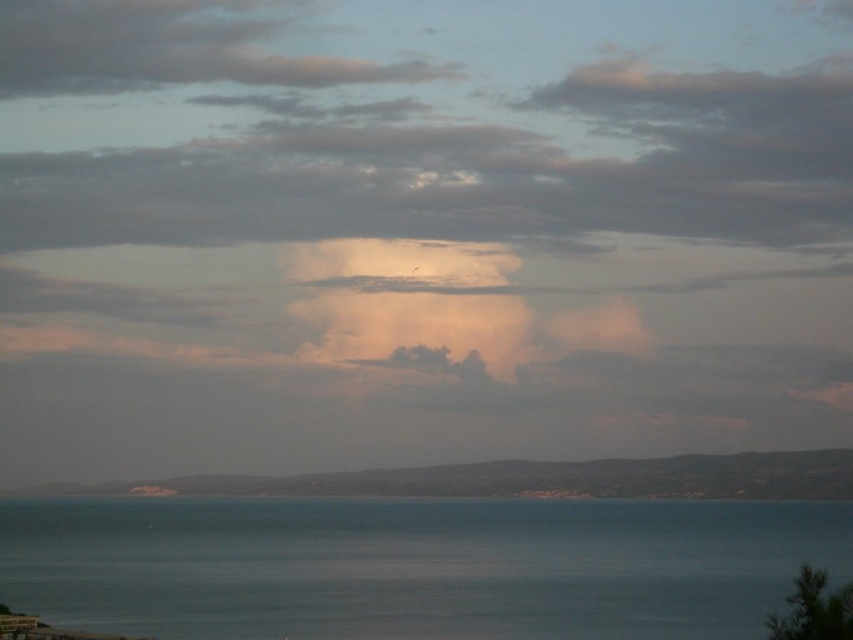
You are standing at the center of the image and want to walk towards the point labeled as point [415,566]. Based on the scene description, what will you encounter when you reach that point?

The point [415,566] corresponds to blue water at center, so you will encounter blue water at center when you reach that point.

You are standing on the beach and want to walk to the water. Which direction should you go from the smooth sand at lower center to reach the blue water at center?

The blue water at center is in front of the smooth sand at lower center, so you should walk forward from the smooth sand at lower center to reach the blue water at center.

You are standing on the beach and want to walk towards the blue water at center. Which direction should you move relative to the smooth sand at lower center?

To reach the blue water at center from the smooth sand at lower center, you should move towards the center of the image since the blue water at center is positioned above the smooth sand at lower center.